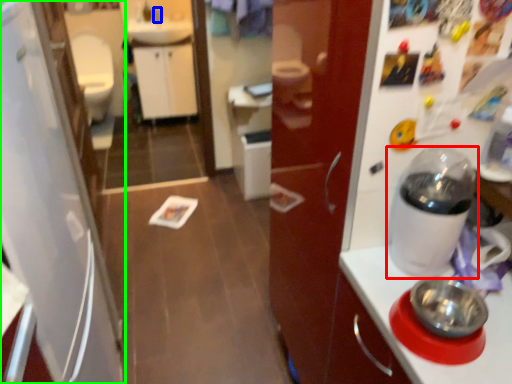
Question: Which object is the farthest from home appliance (highlighted by a red box)? Choose among these: faucet (highlighted by a blue box) or refrigerator (highlighted by a green box).

Choices:
 (A) faucet
 (B) refrigerator

Answer: (A)